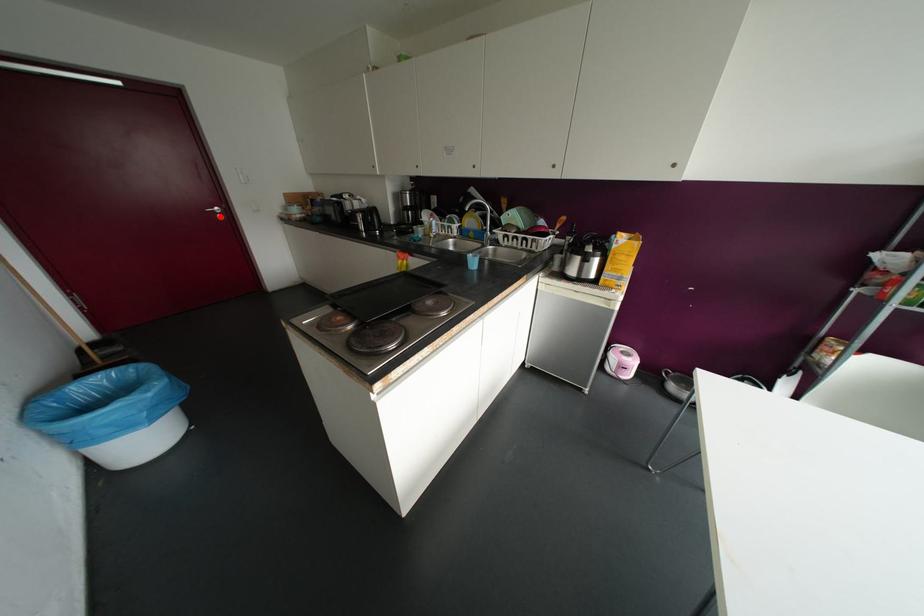
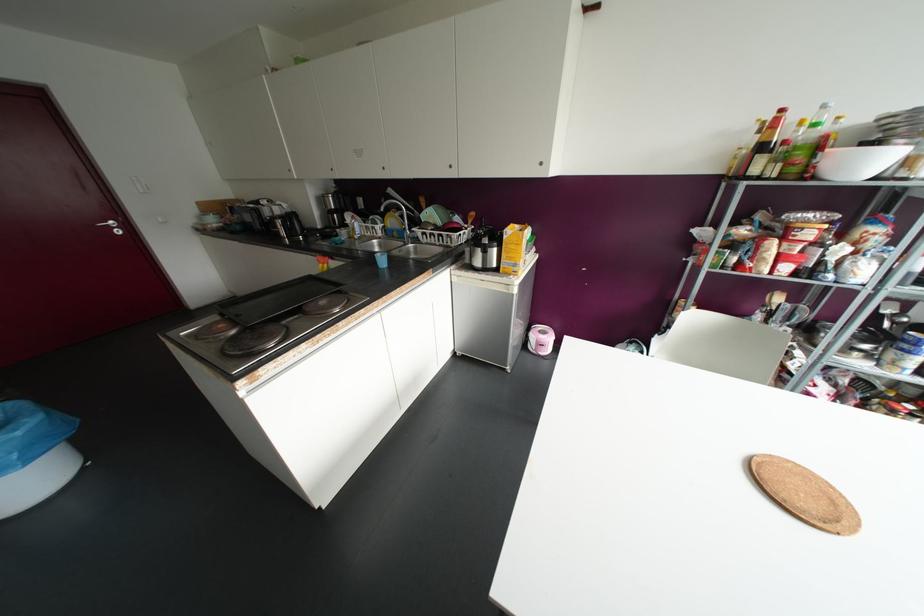
Question: I am providing you with two images of the same scene from different viewpoints. Given a red point in image1, look at the same physical point in image2. Is it:

Choices:
 (A) Closer to the viewpoint
 (B) Farther from the viewpoint

Answer: (B)